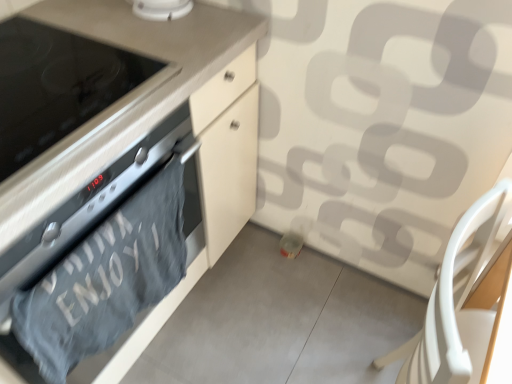
Identify the location of vacant space situated above black glass stove at left (from a real-world perspective). (52, 81).